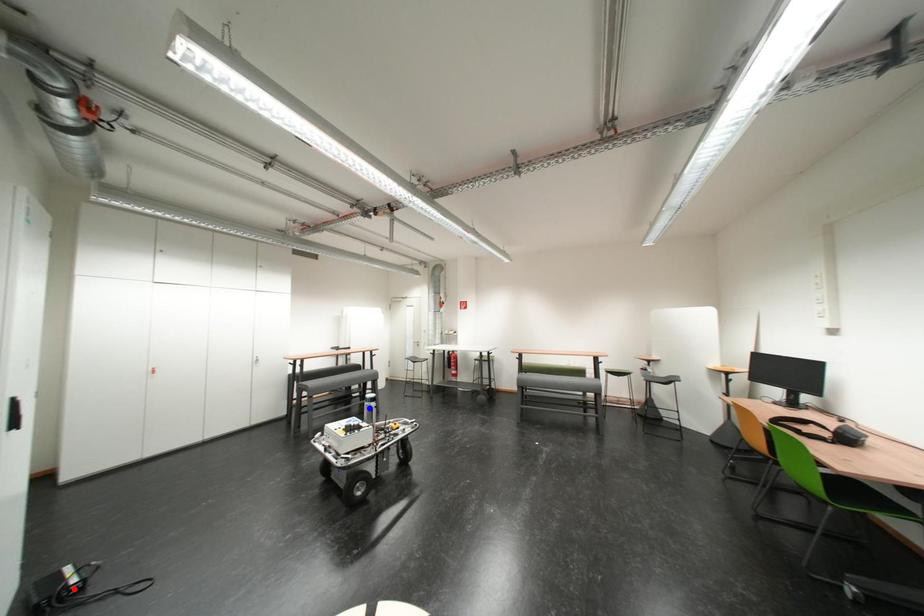
Question: In the image, two points are highlighted. Which point is nearer to the camera? Reply with the corresponding letter.

Choices:
 (A) blue point
 (B) red point

Answer: (B)